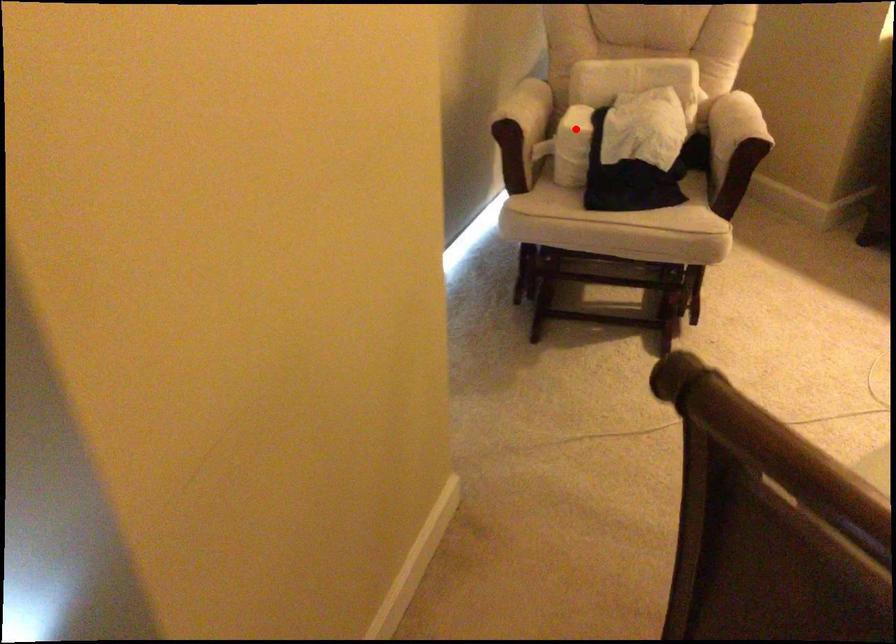
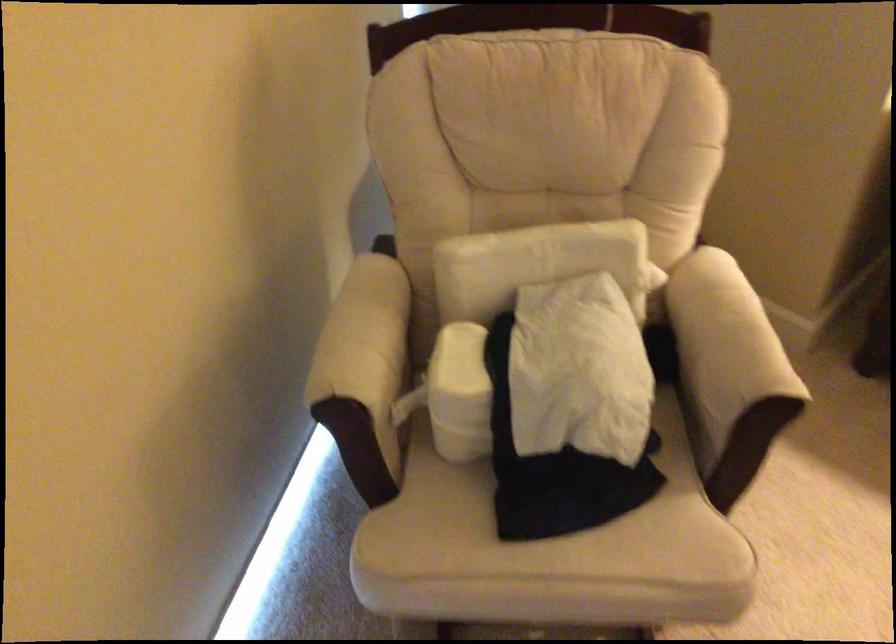
Locate, in the second image, the point that corresponds to the highlighted location in the first image.

(460, 393)